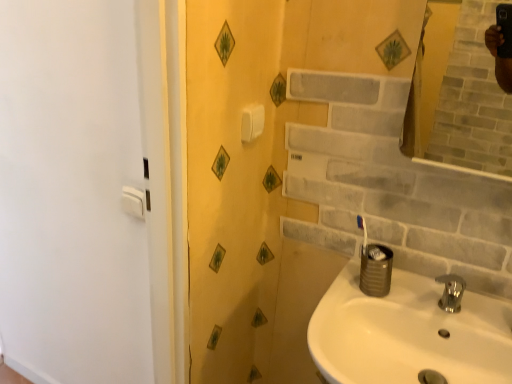
Question: Considering the positions of white glossy sink at lower right and polished chrome faucet at lower right in the image, is white glossy sink at lower right bigger or smaller than polished chrome faucet at lower right?

Choices:
 (A) small
 (B) big

Answer: (B)

Question: From the image's perspective, is white glossy sink at lower right located above or below polished chrome faucet at lower right?

Choices:
 (A) above
 (B) below

Answer: (B)

Question: Considering the relative positions of white glossy sink at lower right and polished chrome faucet at lower right in the image provided, is white glossy sink at lower right to the left or to the right of polished chrome faucet at lower right?

Choices:
 (A) left
 (B) right

Answer: (A)

Question: Based on their sizes in the image, would you say polished chrome faucet at lower right is bigger or smaller than white glossy sink at lower right?

Choices:
 (A) small
 (B) big

Answer: (A)

Question: Considering the positions of polished chrome faucet at lower right and white glossy sink at lower right in the image, is polished chrome faucet at lower right wider or thinner than white glossy sink at lower right?

Choices:
 (A) wide
 (B) thin

Answer: (B)

Question: Considering the positions of polished chrome faucet at lower right and white glossy sink at lower right in the image, is polished chrome faucet at lower right taller or shorter than white glossy sink at lower right?

Choices:
 (A) tall
 (B) short

Answer: (B)

Question: Considering the positions of point (448, 276) and point (374, 377), is point (448, 276) closer or farther from the camera than point (374, 377)?

Choices:
 (A) farther
 (B) closer

Answer: (A)